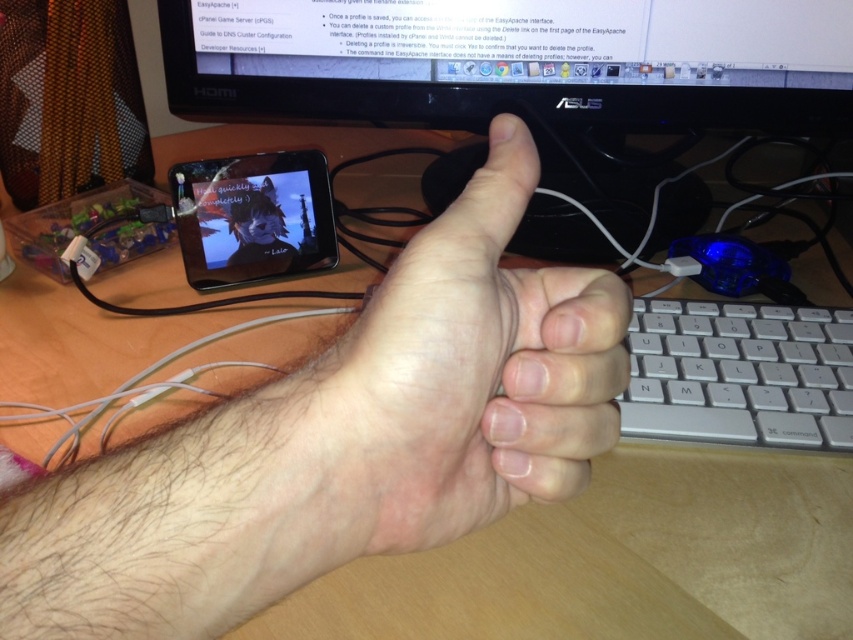
Question: Is black plastic monitor at upper center closer to the viewer compared to silver metallic keyboard at right?

Choices:
 (A) no
 (B) yes

Answer: (A)

Question: Among these objects, which one is farthest from the camera?

Choices:
 (A) black plastic monitor at upper center
 (B) skinny flesh at center
 (C) matte black tablet at center

Answer: (C)

Question: Estimate the real-world distances between objects in this image. Which object is closer to the black plastic monitor at upper center?

Choices:
 (A) matte black tablet at center
 (B) skinny flesh at center

Answer: (A)

Question: Is silver metallic keyboard at right to the right of matte black tablet at center from the viewer's perspective?

Choices:
 (A) no
 (B) yes

Answer: (B)

Question: Which point is farther to the camera?

Choices:
 (A) skinny flesh at center
 (B) black plastic monitor at upper center
 (C) silver metallic keyboard at right
 (D) matte black tablet at center

Answer: (D)

Question: Does black plastic monitor at upper center have a smaller size compared to skinny flesh at center?

Choices:
 (A) no
 (B) yes

Answer: (A)